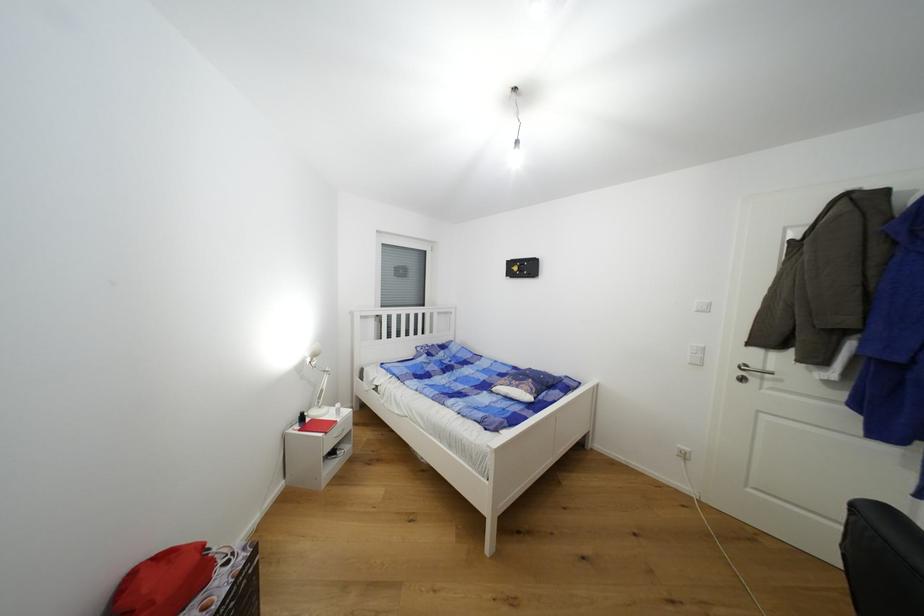
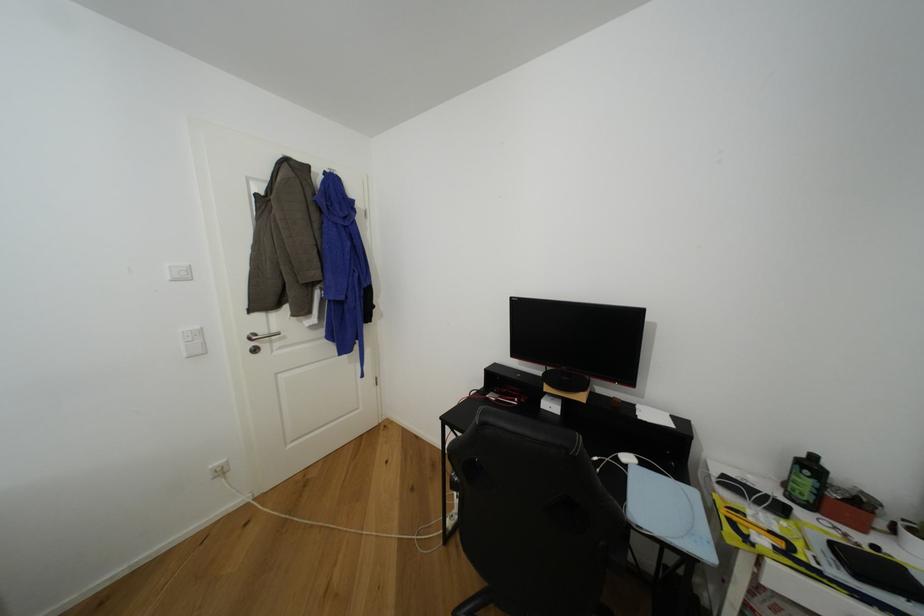
The point at (760, 368) is marked in the first image. Where is the corresponding point in the second image?

(268, 334)